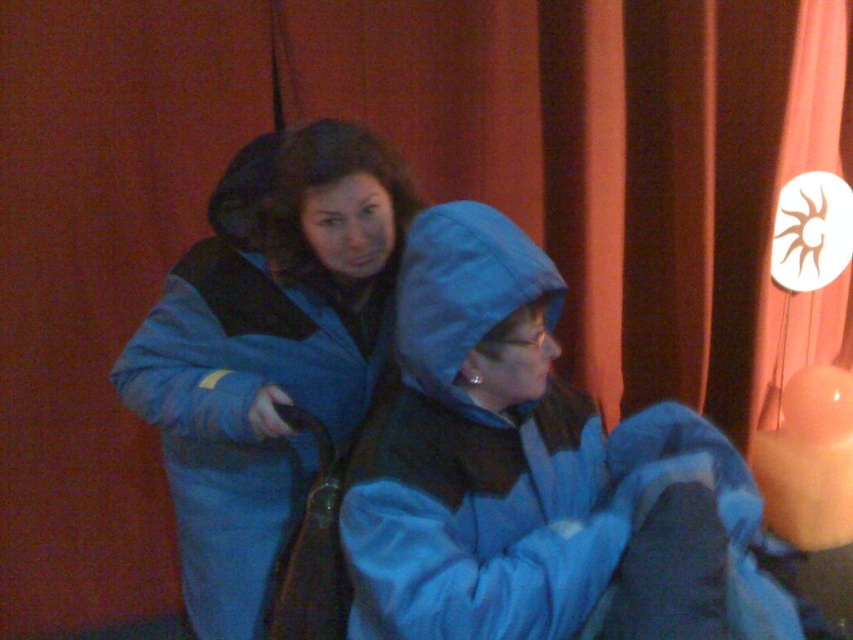
Who is positioned more to the left, blue fleece jacket at center or blue fuzzy coat at center?

blue fuzzy coat at center is more to the left.

Who is more forward, (442,444) or (187,612)?

Point (442,444) is more forward.

Which is in front, point (660, 618) or point (372, 150)?

Point (660, 618) is more forward.

Find the location of `blue fleece jacket at center`. blue fleece jacket at center is located at coordinates (532, 474).